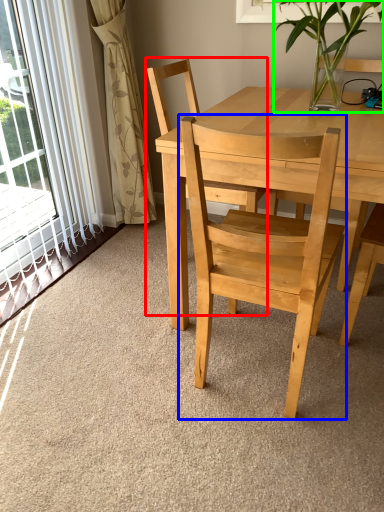
Question: Which object is positioned farthest from chair (highlighted by a red box)? Select from chair (highlighted by a blue box) and houseplant (highlighted by a green box).

Choices:
 (A) chair
 (B) houseplant

Answer: (A)